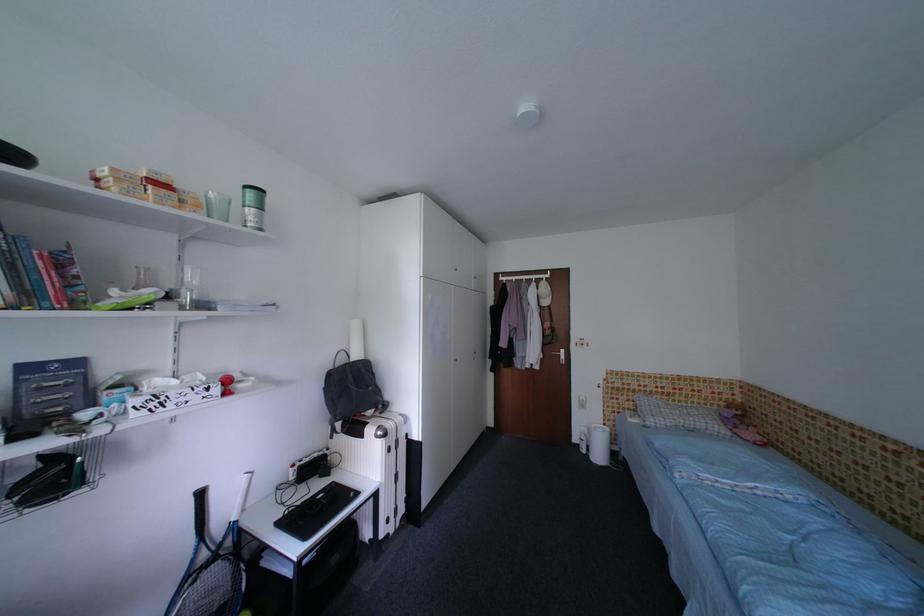
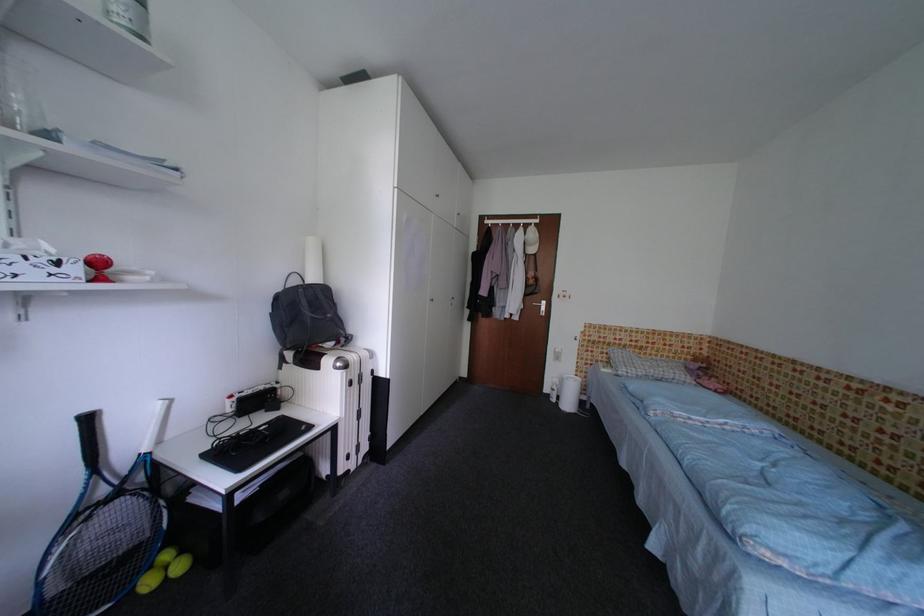
Find the pixel in the second image that matches (707,406) in the first image.

(675, 360)